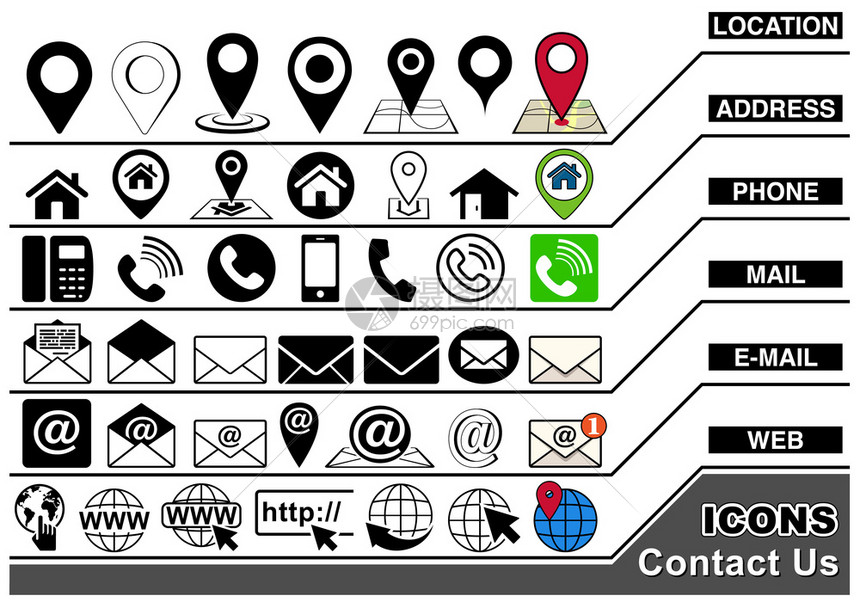
The image size is (860, 608). I want to click on phones, so click(x=562, y=288), click(x=473, y=282), click(x=383, y=249), click(x=315, y=268), click(x=255, y=295), click(x=157, y=299), click(x=64, y=266).